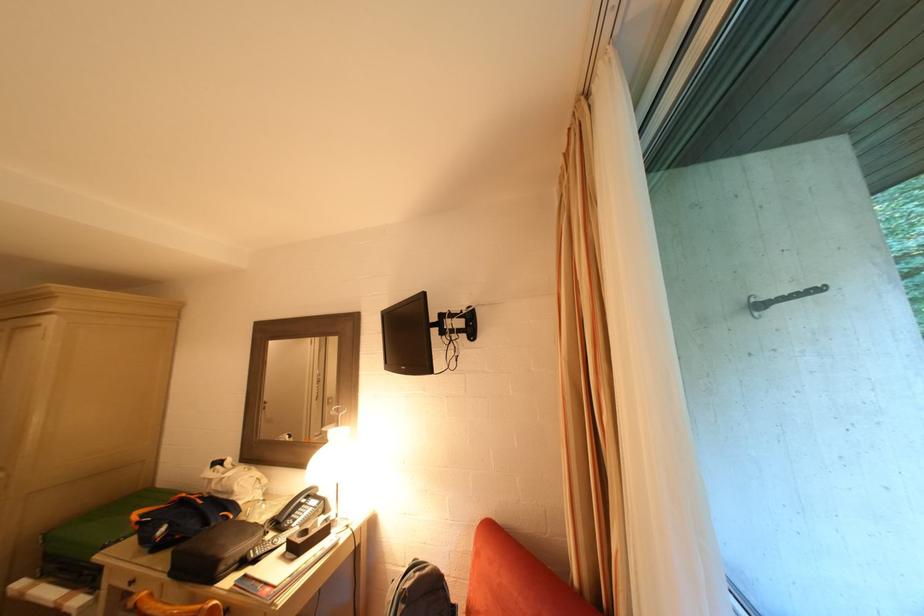
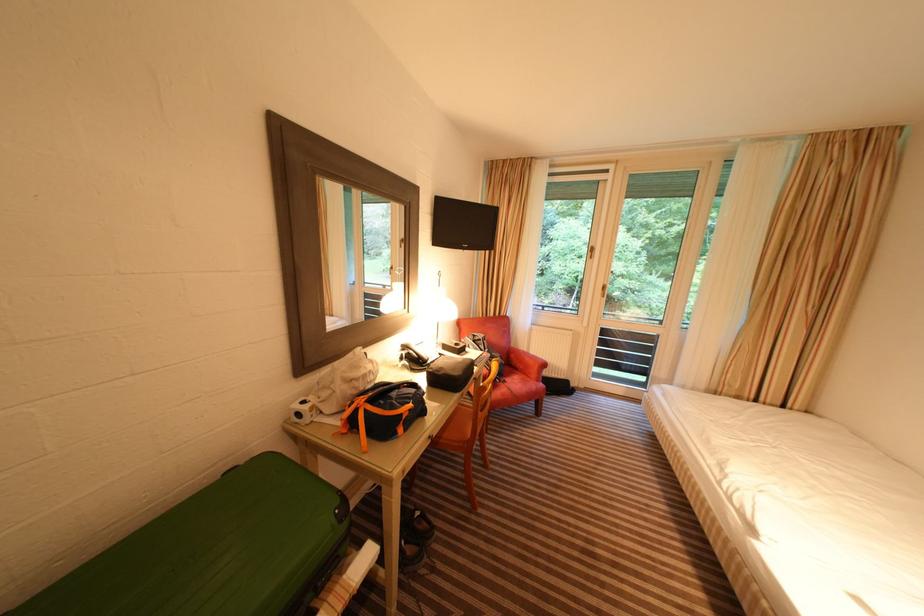
Where in the second image is the point corresponding to the point at 306,508 from the first image?

(423, 355)